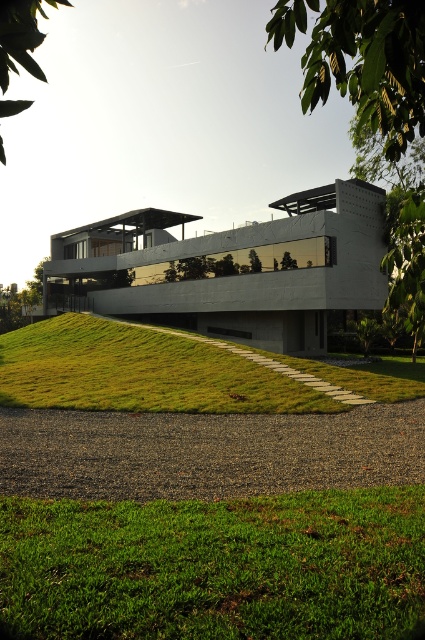
Does green leafy tree at upper right appear under green leafy tree at upper left?

Yes, green leafy tree at upper right is below green leafy tree at upper left.

Does green leafy tree at upper right come behind green leafy tree at upper left?

Yes.

Is point (351, 76) positioned after point (10, 36)?

Yes, point (351, 76) is farther from viewer.

Find the location of a particular element. Image resolution: width=425 pixels, height=640 pixels. green leafy tree at upper right is located at coordinates (362, 60).

Does green grassy at lower center appear on the left side of green leafy tree at upper right?

Yes, green grassy at lower center is to the left of green leafy tree at upper right.

Between green grassy at lower center and green leafy tree at upper right, which one is positioned higher?

Positioned higher is green leafy tree at upper right.

Locate an element on the screen. The image size is (425, 640). green grassy at lower center is located at coordinates (215, 566).

The width and height of the screenshot is (425, 640). Identify the location of green grassy at lower center. (215, 566).

Does green grass at center have a larger size compared to green leafy tree at upper left?

No, green grass at center is not bigger than green leafy tree at upper left.

The width and height of the screenshot is (425, 640). I want to click on green grass at center, so click(138, 371).

Find the location of a particular element. green grass at center is located at coordinates (138, 371).